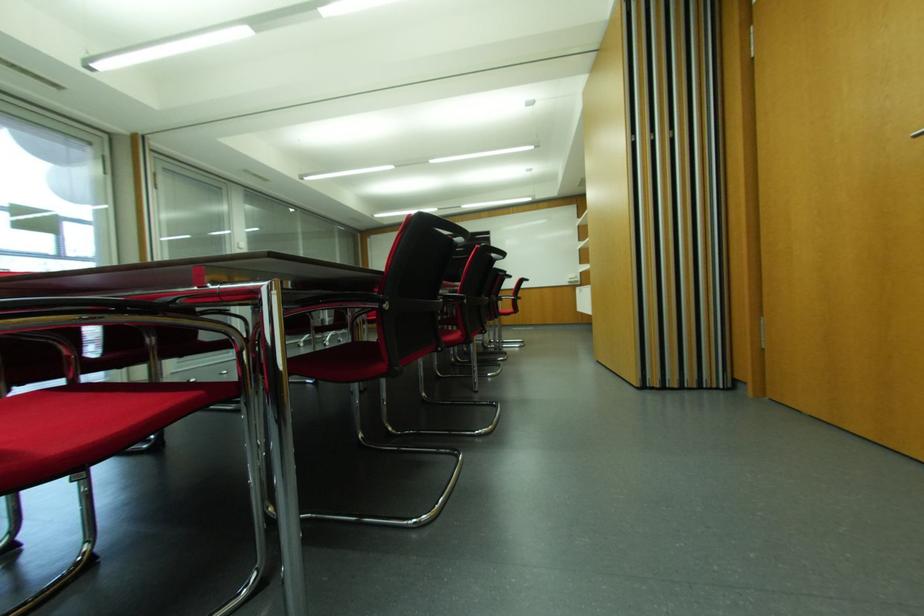
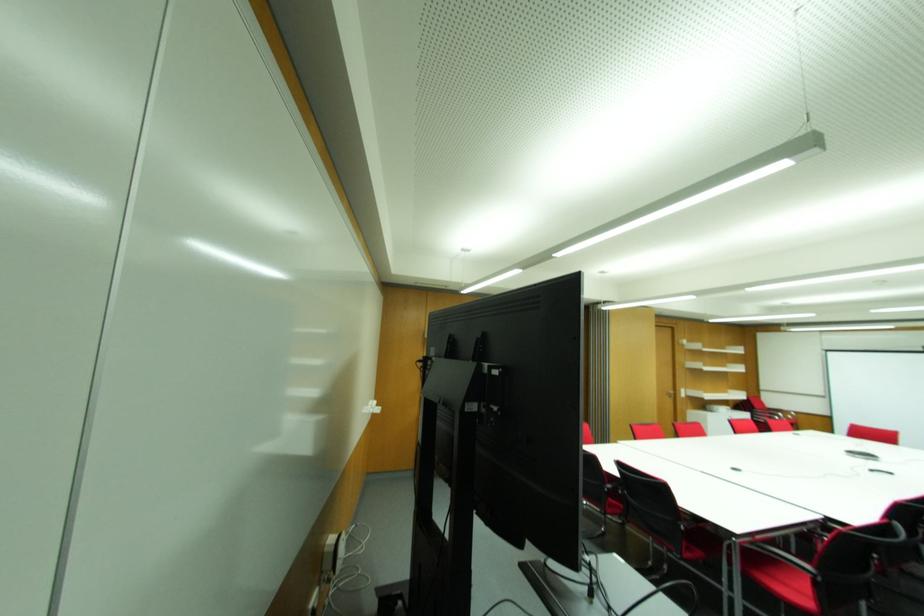
Question: I am providing you with two images of the same scene from different viewpoints. Which of the following objects are not visible in image2?

Choices:
 (A) metal door handle
 (B) black chair armrest
 (C) green dumbbell
 (D) red chair sitting surface

Answer: (D)